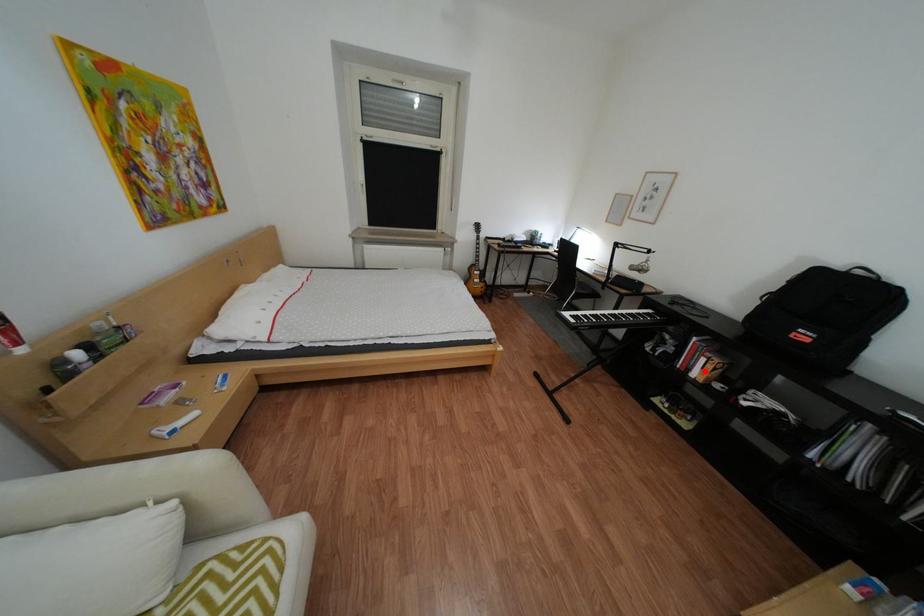
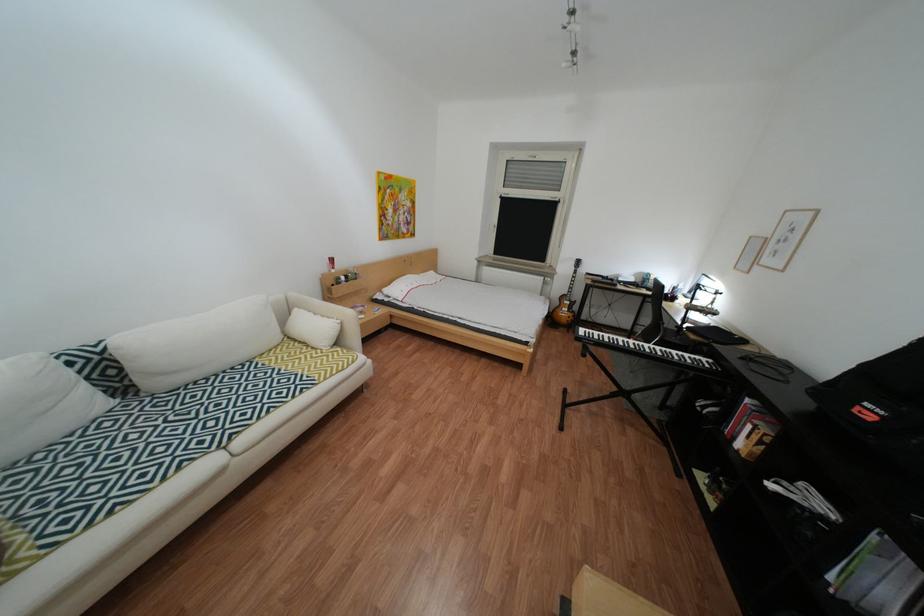
In the second image, find the point that corresponds to the highlighted location in the first image.

(749, 439)